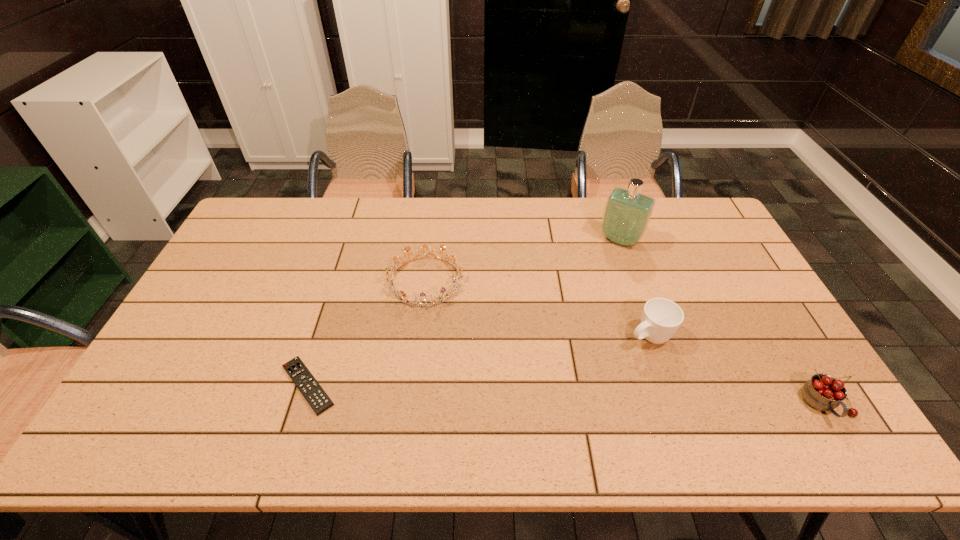
The height and width of the screenshot is (540, 960). Find the location of `free space located 0.140m on the front label of the perfume`. free space located 0.140m on the front label of the perfume is located at coordinates (596, 275).

Identify the location of vacant point located 0.220m on the front label of the perfume. This screenshot has width=960, height=540. (587, 291).

This screenshot has width=960, height=540. Identify the location of vacant space situated on the front-facing side of the second farthest object. (515, 390).

Image resolution: width=960 pixels, height=540 pixels. I want to click on vacant space located on the front-facing side of the second farthest object, so click(x=457, y=319).

This screenshot has width=960, height=540. What are the coordinates of `free spot located on the front-facing side of the second farthest object` in the screenshot? It's located at (490, 360).

Locate an element on the screen. free space located with the handle on the side of the third nearest object is located at coordinates (586, 370).

Find the location of a particular element. vacant area located with the handle on the side of the third nearest object is located at coordinates (540, 397).

Identify the location of blank area located 0.110m with the handle on the side of the third nearest object. Image resolution: width=960 pixels, height=540 pixels. (600, 362).

What are the coordinates of `object present at the far edge` in the screenshot? It's located at (627, 213).

Locate an element on the screen. The image size is (960, 540). remote control that is at the near edge is located at coordinates (314, 394).